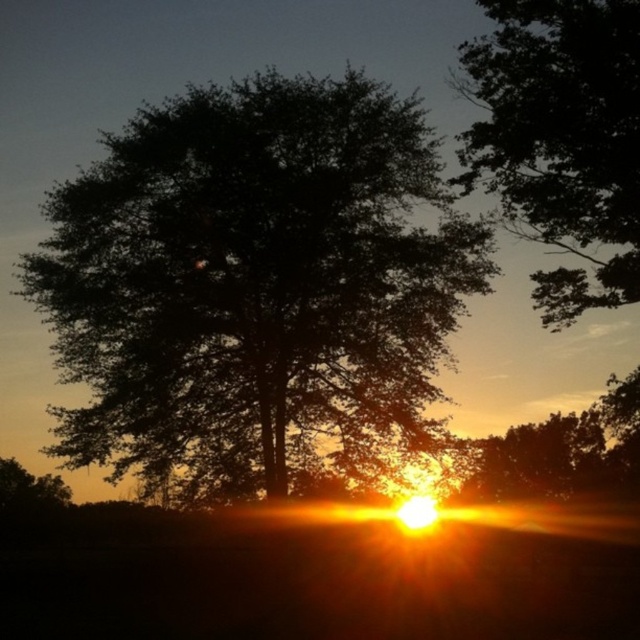
Question: Is the position of dark green leafy tree at center less distant than that of dark green leafy tree at upper center?

Choices:
 (A) no
 (B) yes

Answer: (A)

Question: Which of the following is the farthest from the observer?

Choices:
 (A) dark green leafy tree at upper center
 (B) dark green leafy tree at center

Answer: (B)

Question: Can you confirm if dark green leafy tree at center is bigger than dark green leafy tree at upper center?

Choices:
 (A) no
 (B) yes

Answer: (B)

Question: Does dark green leafy tree at center have a smaller size compared to dark green leafy tree at upper center?

Choices:
 (A) yes
 (B) no

Answer: (B)